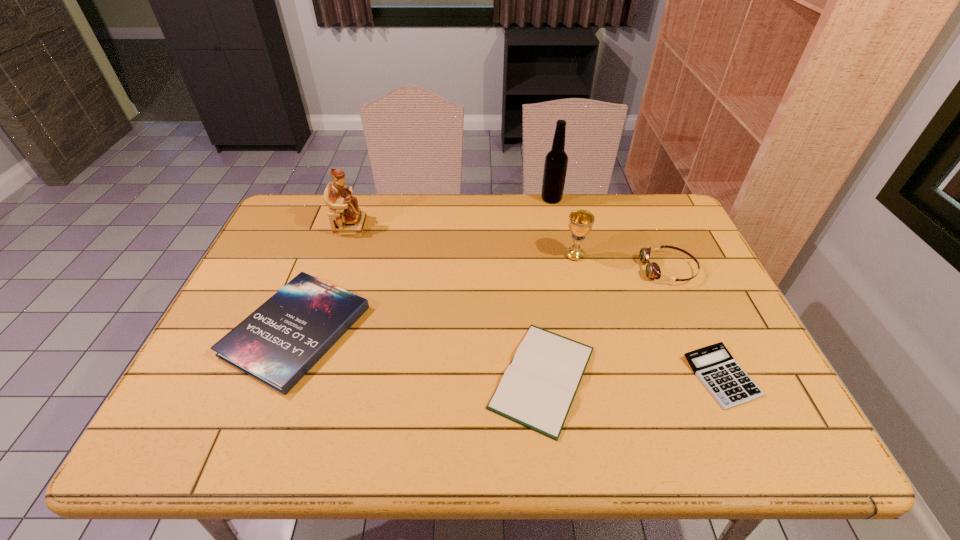
Locate an element on the screen. The image size is (960, 540). object that stands as the fifth closest to the goggles is located at coordinates (277, 344).

The height and width of the screenshot is (540, 960). In order to click on free space that satisfies the following two spatial constraints: 1. on the front-facing side of the second farthest object; 2. on the back side of the third tallest object in this screenshot , I will do `click(341, 255)`.

Where is `free point that satisfies the following two spatial constraints: 1. through the lenses of the goggles; 2. on the left side of the calculator`? This screenshot has height=540, width=960. free point that satisfies the following two spatial constraints: 1. through the lenses of the goggles; 2. on the left side of the calculator is located at coordinates (717, 376).

You are a GUI agent. You are given a task and a screenshot of the screen. Output one action in this format:
    pyautogui.click(x=<x>, y=<y>)
    Task: Click on the free spot that satisfies the following two spatial constraints: 1. on the back side of the shortest object; 2. through the lenses of the goggles
    This screenshot has height=540, width=960.
    Given the screenshot: What is the action you would take?
    pyautogui.click(x=672, y=269)

This screenshot has height=540, width=960. Identify the location of vacant space that satisfies the following two spatial constraints: 1. on the front side of the farthest object; 2. on the front-facing side of the second farthest object. (557, 225).

The image size is (960, 540). In order to click on free location that satisfies the following two spatial constraints: 1. on the front-facing side of the sixth shortest object; 2. on the front side of the fifth tallest object in this screenshot , I will do `click(315, 330)`.

The image size is (960, 540). Find the location of `free space that satisfies the following two spatial constraints: 1. on the front-facing side of the shorter hardback book; 2. on the right side of the figurine`. free space that satisfies the following two spatial constraints: 1. on the front-facing side of the shorter hardback book; 2. on the right side of the figurine is located at coordinates (299, 377).